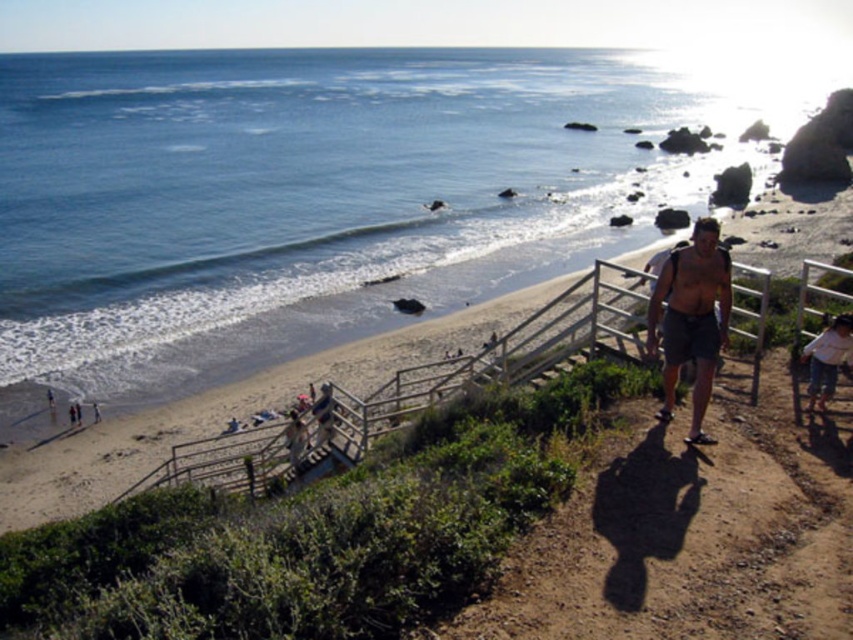
Question: Estimate the real-world distances between objects in this image. Which object is closer to the light brown wooden stick at lower left?

Choices:
 (A) white cotton shirt at lower right
 (B) gray shorts at right

Answer: (B)

Question: Which of the following is the closest to the observer?

Choices:
 (A) (817, 344)
 (B) (677, 284)
 (C) (97, 412)

Answer: (B)

Question: Which object is farther from the camera taking this photo?

Choices:
 (A) gray shorts at right
 (B) light brown wooden stick at lower left
 (C) white cotton shirt at lower right

Answer: (B)

Question: Is gray shorts at right to the right of white cotton shirt at lower right from the viewer's perspective?

Choices:
 (A) yes
 (B) no

Answer: (B)

Question: Can you confirm if white cotton shirt at lower right is wider than light brown wooden stick at lower left?

Choices:
 (A) no
 (B) yes

Answer: (B)

Question: Is white cotton shirt at lower right positioned at the back of light brown wooden stick at lower left?

Choices:
 (A) no
 (B) yes

Answer: (A)